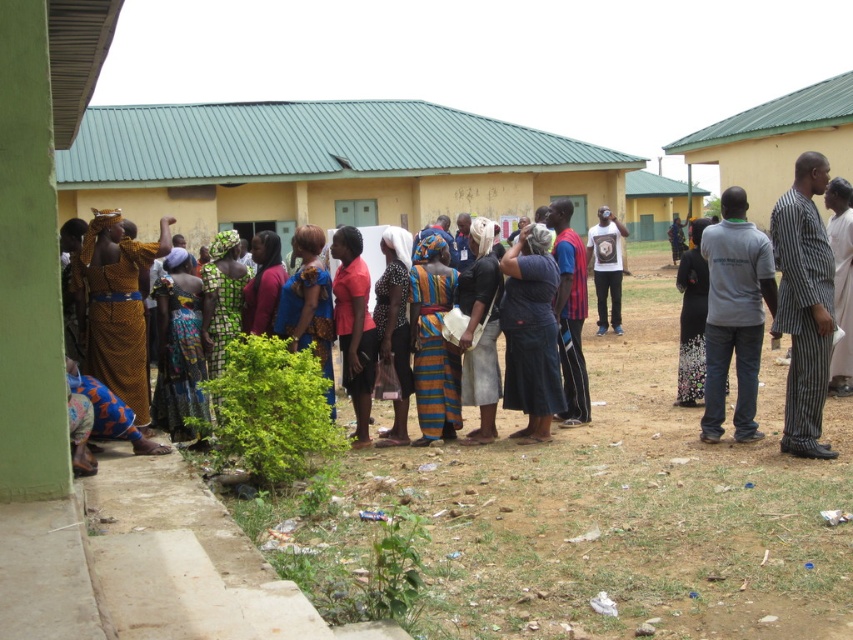
Question: Does striped fabric dress at center appear under black printed dress at center?

Choices:
 (A) no
 (B) yes

Answer: (A)

Question: Does matte red blouse at center appear under blue fabric bag at center?

Choices:
 (A) no
 (B) yes

Answer: (B)

Question: Which object appears farthest from the camera in this image?

Choices:
 (A) multicolored fabric people at center
 (B) black printed dress at center
 (C) black woven cloth at center
 (D) matte red shirt at center

Answer: (B)

Question: Which point is closer to the camera?

Choices:
 (A) matte red shirt at center
 (B) green printed dress at center

Answer: (A)

Question: Is dark blue fabric at center to the left of matte red shirt at center from the viewer's perspective?

Choices:
 (A) yes
 (B) no

Answer: (B)

Question: Which point is farther from the camera taking this photo?

Choices:
 (A) (595, 360)
 (B) (132, 262)
 (C) (401, 324)
 (D) (480, 369)

Answer: (A)